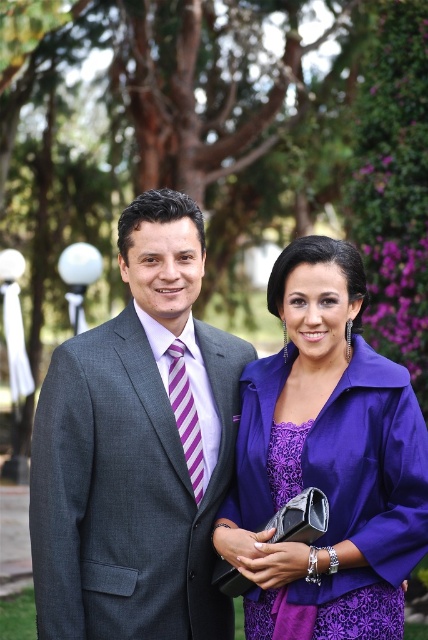
Question: Can you confirm if matte gray suit at center is positioned to the left of purple striped tie at center?

Choices:
 (A) yes
 (B) no

Answer: (A)

Question: Which point is farther from the camera taking this photo?

Choices:
 (A) (344, 580)
 (B) (195, 404)
 (C) (53, 428)

Answer: (B)

Question: Is matte gray suit at center positioned before purple striped tie at center?

Choices:
 (A) yes
 (B) no

Answer: (A)

Question: Is matte gray suit at center positioned behind purple striped tie at center?

Choices:
 (A) no
 (B) yes

Answer: (A)

Question: Among these objects, which one is farthest from the camera?

Choices:
 (A) matte gray suit at center
 (B) purple striped tie at center

Answer: (B)

Question: Which object is closer to the camera taking this photo?

Choices:
 (A) purple striped tie at center
 (B) purple satin dress at center

Answer: (B)